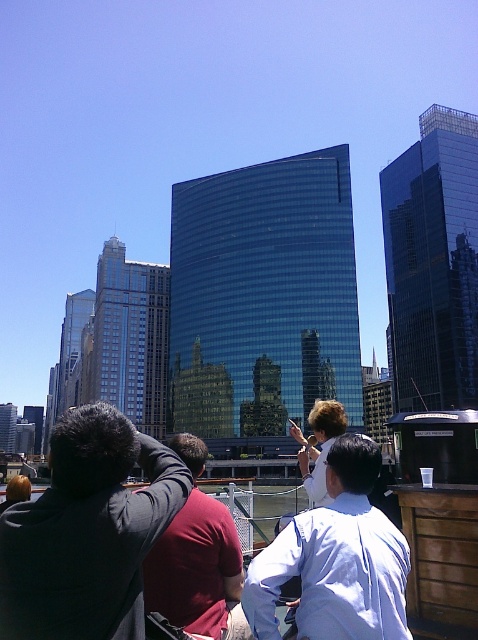
Question: Can you confirm if black fabric jacket at center is smaller than light blue shirt at center?

Choices:
 (A) yes
 (B) no

Answer: (B)

Question: Which object is closer to the camera taking this photo?

Choices:
 (A) blonde hair at lower left
 (B) light brown leather jacket at center
 (C) red shirt at center
 (D) black fabric jacket at center

Answer: (D)

Question: Is black fabric jacket at center smaller than red shirt at center?

Choices:
 (A) no
 (B) yes

Answer: (A)

Question: Can you confirm if black fabric jacket at center is wider than red shirt at center?

Choices:
 (A) yes
 (B) no

Answer: (A)

Question: Which point is closer to the camera?

Choices:
 (A) light blue shirt at center
 (B) black fabric jacket at center
 (C) red shirt at center

Answer: (B)

Question: Which object appears farthest from the camera in this image?

Choices:
 (A) blonde hair at lower left
 (B) black fabric jacket at center
 (C) light brown leather jacket at center
 (D) red shirt at center

Answer: (A)